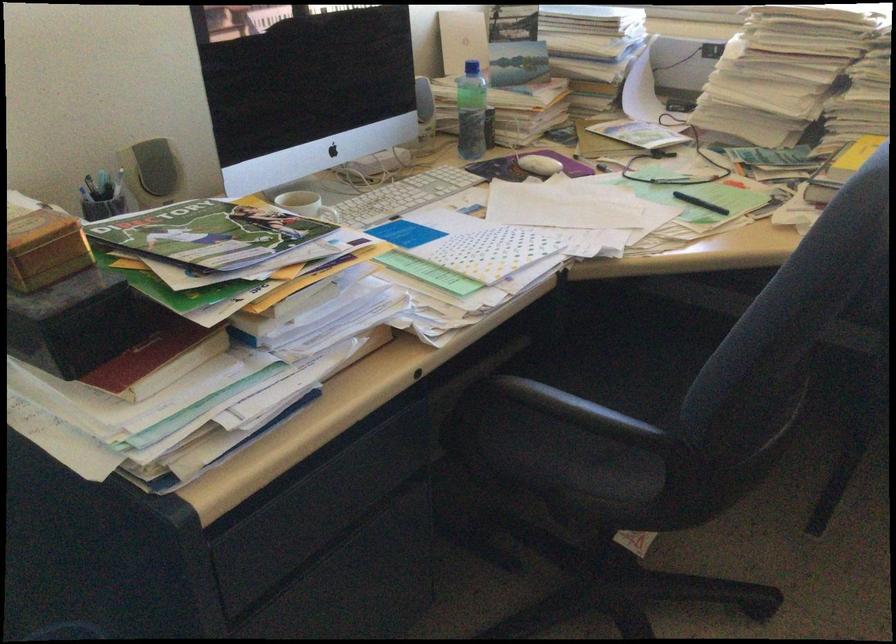
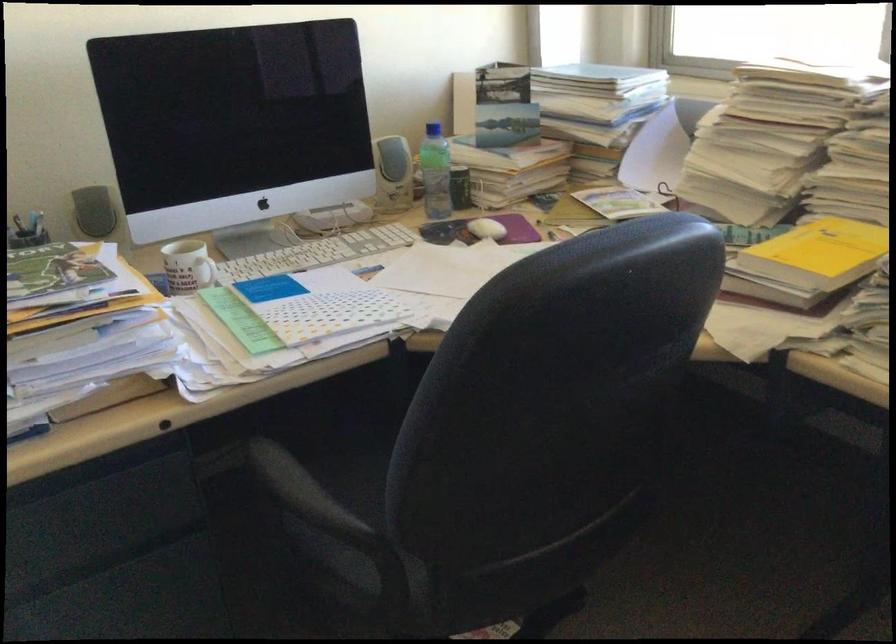
Where in the second image is the point corresponding to point 616,433 from the first image?

(314, 521)